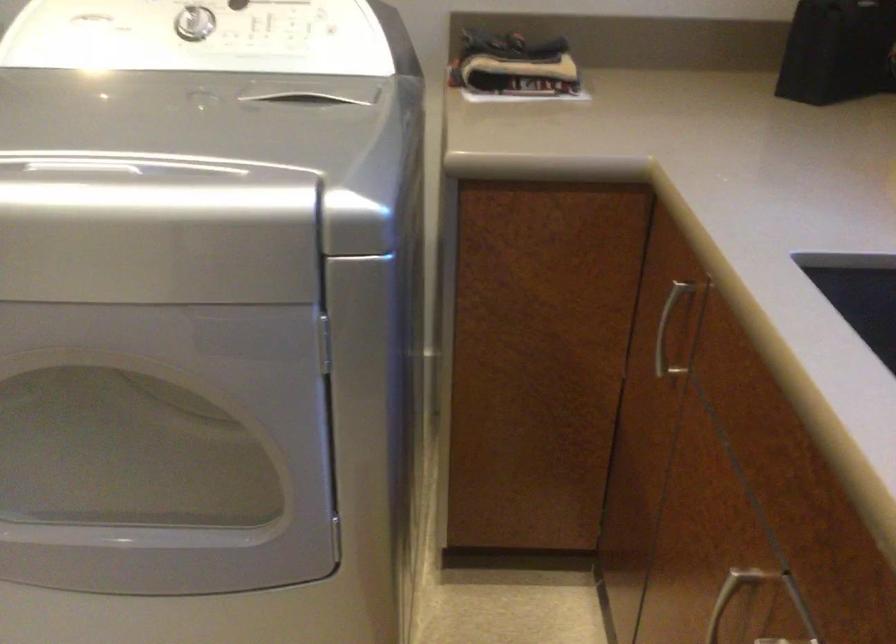
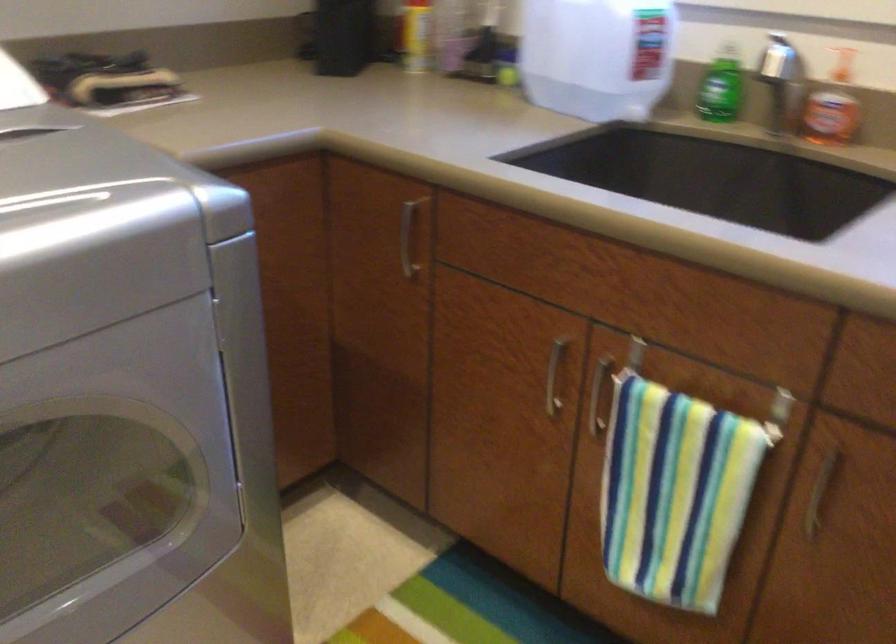
Question: The camera is either moving clockwise (left) or counter-clockwise (right) around the object. The first image is from the beginning of the video and the second image is from the end. Is the camera moving left or right when shooting the video?

Choices:
 (A) Left
 (B) Right

Answer: (A)